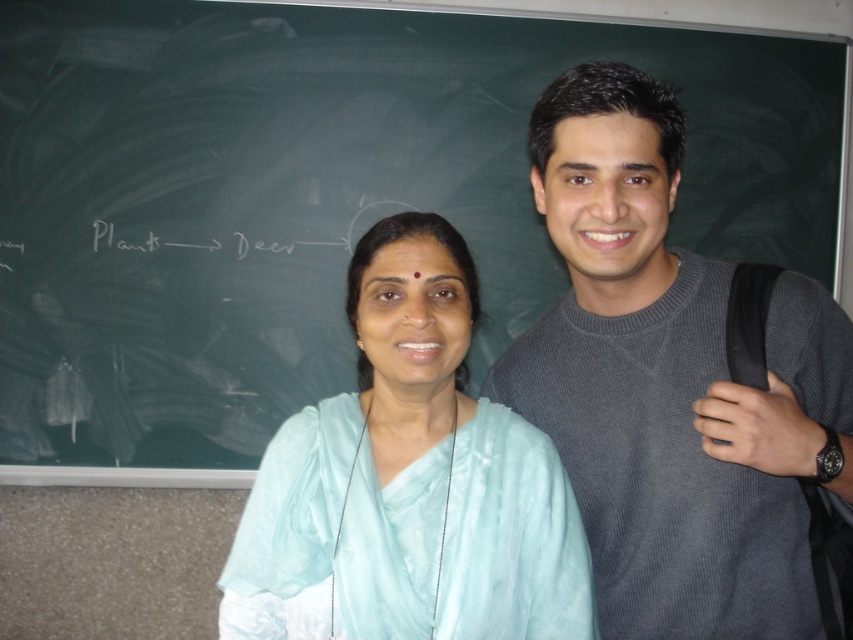
Can you confirm if gray sweater at center is taller than light blue silk saree at center?

Yes.

What do you see at coordinates (672, 384) in the screenshot?
I see `gray sweater at center` at bounding box center [672, 384].

This screenshot has width=853, height=640. What are the coordinates of `gray sweater at center` in the screenshot? It's located at (672, 384).